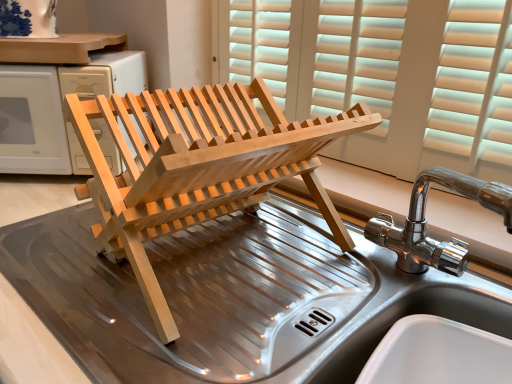
The image size is (512, 384). Describe the element at coordinates (425, 223) in the screenshot. I see `chrome metallic tap at right` at that location.

Find the location of a particular element. This screenshot has width=512, height=384. natural wood dish rack at center is located at coordinates (231, 298).

You are a GUI agent. You are given a task and a screenshot of the screen. Output one action in this format:
    pyautogui.click(x=<x>, y=<y>)
    Task: Click on the natural wood dish rack at center
    
    Given the screenshot: What is the action you would take?
    pyautogui.click(x=57, y=109)

Is natural wood dish rack at center inside or outside of natural wood dish rack at center?

The correct answer is: outside.

Which is further, (109, 144) or (232, 231)?

The point (109, 144) is farther from the camera.

Which object is thinner, natural wood dish rack at center or natural wood dish rack at center?

Thinner between the two is natural wood dish rack at center.

Could you tell me if chrome metallic tap at right is facing natural wood dish rack at center?

No, chrome metallic tap at right is not turned towards natural wood dish rack at center.

In the scene shown: From a real-world perspective, relative to natural wood dish rack at center, is chrome metallic tap at right vertically above or below?

chrome metallic tap at right is situated higher than natural wood dish rack at center in the real world.

Looking at this image, how different are the orientations of chrome metallic tap at right and natural wood dish rack at center in degrees?

chrome metallic tap at right and natural wood dish rack at center are facing 1.54 degrees away from each other.

From the image's perspective, is chrome metallic tap at right on top of natural wood dish rack at center?

Yes, from the image's perspective, chrome metallic tap at right is above natural wood dish rack at center.

Where is `furniture located on the right of natural wood dish rack at center`? furniture located on the right of natural wood dish rack at center is located at coordinates (197, 167).

Is the depth of natural wood dish rack at center greater than that of natural wood dish rack at center?

Yes, the depth of natural wood dish rack at center is greater than that of natural wood dish rack at center.

From a real-world perspective, is natural wood dish rack at center on natural wood dish rack at center?

Yes, from a real-world perspective, natural wood dish rack at center is above natural wood dish rack at center.

From a real-world perspective, is natural wood dish rack at center below chrome metallic tap at right?

No, from a real-world perspective, natural wood dish rack at center is not below chrome metallic tap at right.

Which of these two, natural wood dish rack at center or chrome metallic tap at right, stands shorter?

With less height is chrome metallic tap at right.

Based on the photo, is natural wood dish rack at center not inside chrome metallic tap at right?

Absolutely, natural wood dish rack at center is external to chrome metallic tap at right.

At what (x,y) coordinates should I click in order to perform the action: click on tap below the natural wood dish rack at center (from the image's perspective). Please return your answer as a coordinate pair (x, y). The height and width of the screenshot is (384, 512). Looking at the image, I should click on (x=425, y=223).

Looking at this image, can we say natural wood dish rack at center lies outside natural wood dish rack at center?

Indeed, natural wood dish rack at center is completely outside natural wood dish rack at center.

From the image's perspective, is natural wood dish rack at center located above or below natural wood dish rack at center?

From the image's perspective, natural wood dish rack at center appears below natural wood dish rack at center.

Which object is thinner, natural wood dish rack at center or natural wood dish rack at center?

natural wood dish rack at center is thinner.

Considering the sizes of objects natural wood dish rack at center and natural wood dish rack at center in the image provided, who is shorter, natural wood dish rack at center or natural wood dish rack at center?

Standing shorter between the two is natural wood dish rack at center.

Could natural wood dish rack at center be considered to be inside natural wood dish rack at center?

No.

From the image's perspective, is natural wood dish rack at center on top of natural wood dish rack at center?

Actually, natural wood dish rack at center appears below natural wood dish rack at center in the image.

Can you tell me how much natural wood dish rack at center and natural wood dish rack at center differ in facing direction?

They differ by 44.5 degrees in their facing directions.

Does natural wood dish rack at center have a smaller size compared to natural wood dish rack at center?

Incorrect, natural wood dish rack at center is not smaller in size than natural wood dish rack at center.

Considering the relative positions of natural wood dish rack at center and natural wood dish rack at center in the image provided, is natural wood dish rack at center to the left of natural wood dish rack at center from the viewer's perspective?

Yes, natural wood dish rack at center is to the left of natural wood dish rack at center.

Does point (61, 157) appear closer or farther from the camera than point (130, 102)?

Clearly, point (61, 157) is more distant from the camera than point (130, 102).

Who is shorter, natural wood dish rack at center or natural wood dish rack at center?

natural wood dish rack at center is shorter.

Consider the image. From the image's perspective, which is above, natural wood dish rack at center or natural wood dish rack at center?

natural wood dish rack at center is shown above in the image.

The image size is (512, 384). Find the location of `table directly beneath the natural wood dish rack at center (from a real-world perspective)`. table directly beneath the natural wood dish rack at center (from a real-world perspective) is located at coordinates (231, 298).

Where is `tap above the natural wood dish rack at center (from a real-world perspective)`? The image size is (512, 384). tap above the natural wood dish rack at center (from a real-world perspective) is located at coordinates (425, 223).

Considering their positions, is chrome metallic tap at right positioned further to stainless steel sink at center than natural wood dish rack at center?

natural wood dish rack at center is positioned further to the anchor stainless steel sink at center.

Looking at the image, which one is located further to natural wood dish rack at center, stainless steel sink at center or chrome metallic tap at right?

Based on the image, chrome metallic tap at right appears to be further to natural wood dish rack at center.

Based on their spatial positions, is natural wood dish rack at center or natural wood dish rack at center closer to chrome metallic tap at right?

Among the two, natural wood dish rack at center is located nearer to chrome metallic tap at right.

Estimate the real-world distances between objects in this image. Which object is further from chrome metallic tap at right, natural wood dish rack at center or stainless steel sink at center?

The object further to chrome metallic tap at right is natural wood dish rack at center.

Based on the photo, from the image, which object appears to be farther from natural wood dish rack at center, natural wood dish rack at center or chrome metallic tap at right?

chrome metallic tap at right lies further to natural wood dish rack at center than the other object.

From the image, which object appears to be farther from natural wood dish rack at center, stainless steel sink at center or natural wood dish rack at center?

Among the two, stainless steel sink at center is located further to natural wood dish rack at center.

Considering their positions, is natural wood dish rack at center positioned closer to stainless steel sink at center than natural wood dish rack at center?

natural wood dish rack at center.

Which object lies further to the anchor point chrome metallic tap at right, stainless steel sink at center or natural wood dish rack at center?

natural wood dish rack at center.

The image size is (512, 384). What are the coordinates of `furniture positioned between natural wood dish rack at center and natural wood dish rack at center from near to far` in the screenshot? It's located at (197, 167).

Where is `sink between natural wood dish rack at center and natural wood dish rack at center vertically`? sink between natural wood dish rack at center and natural wood dish rack at center vertically is located at coordinates (426, 221).

What are the coordinates of `sink situated between natural wood dish rack at center and chrome metallic tap at right from left to right` in the screenshot? It's located at (426, 221).

Find the location of a particular element. The height and width of the screenshot is (384, 512). furniture located between natural wood dish rack at center and chrome metallic tap at right in the left-right direction is located at coordinates (197, 167).